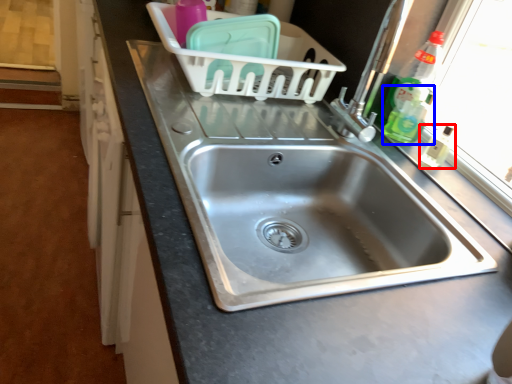
Question: Which object appears closest to the camera in this image, toiletry (highlighted by a red box) or bottle (highlighted by a blue box)?

Choices:
 (A) toiletry
 (B) bottle

Answer: (A)